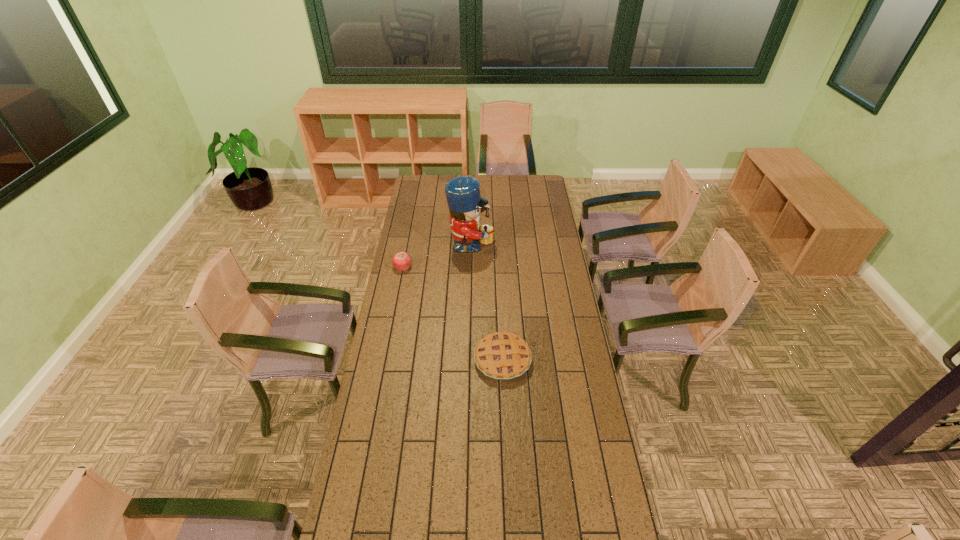
At what (x,y) coordinates should I click in order to perform the action: click on the tallest object. Please return your answer as a coordinate pair (x, y). This screenshot has width=960, height=540. Looking at the image, I should click on (465, 204).

I want to click on the second tallest object, so click(x=402, y=260).

Where is `apple`? apple is located at coordinates (402, 260).

Locate an element on the screen. Image resolution: width=960 pixels, height=540 pixels. the shortest object is located at coordinates (501, 355).

You are a GUI agent. You are given a task and a screenshot of the screen. Output one action in this format:
    pyautogui.click(x=<x>, y=<y>)
    Task: Click on the pie
    The image size is (960, 540).
    Given the screenshot: What is the action you would take?
    pyautogui.click(x=501, y=355)

The width and height of the screenshot is (960, 540). Find the location of `free region located on the front-facing side of the tallest object`. free region located on the front-facing side of the tallest object is located at coordinates (519, 248).

I want to click on vacant space located on the back of the apple, so click(411, 225).

The width and height of the screenshot is (960, 540). I want to click on vacant region located 0.210m on the back of the pie, so click(x=500, y=303).

At what (x,y) coordinates should I click in order to perform the action: click on object at the left edge. Please return your answer as a coordinate pair (x, y). This screenshot has width=960, height=540. Looking at the image, I should click on (402, 260).

Image resolution: width=960 pixels, height=540 pixels. Identify the location of blank space at the far edge. (501, 190).